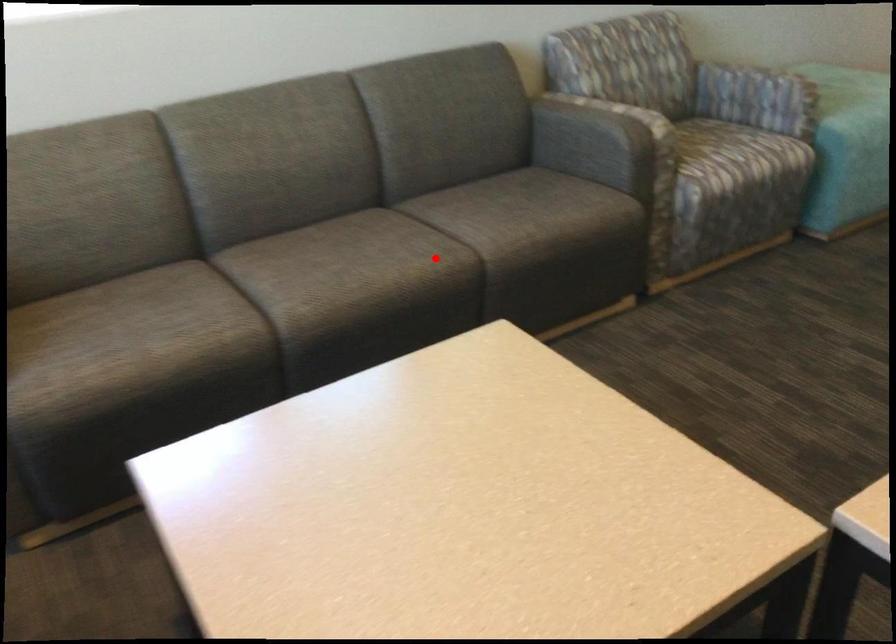
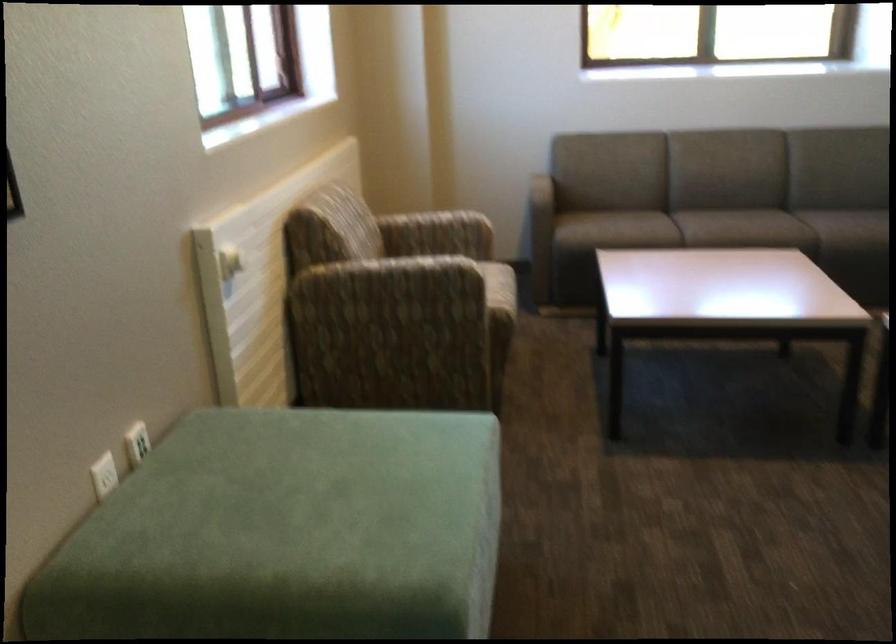
In the second image, find the point that corresponds to the highlighted location in the first image.

(780, 229)